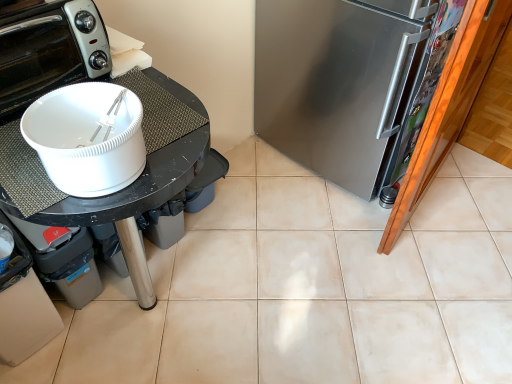
At what (x,y) coordinates should I click in order to perform the action: click on free spot to the right of black matte table at left. Please return your answer as a coordinate pair (x, y). The width and height of the screenshot is (512, 384). Looking at the image, I should click on (279, 281).